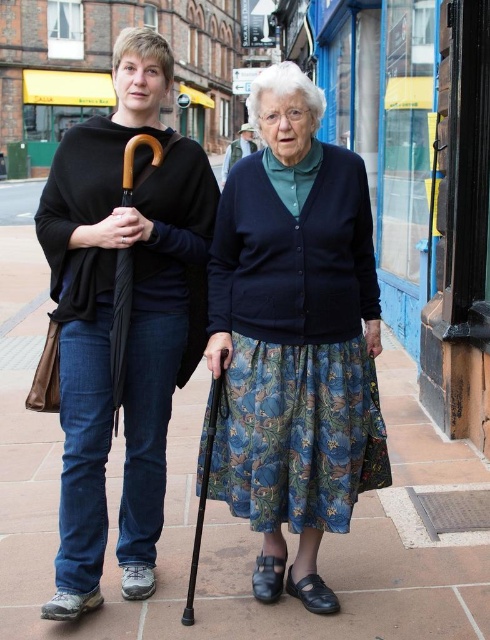
Question: Can you confirm if matte black umbrella at left is bigger than blue floral skirt at center?

Choices:
 (A) yes
 (B) no

Answer: (A)

Question: Which object is the farthest from the wooden cane at lower center?

Choices:
 (A) black matte umbrella at left
 (B) matte black umbrella at left
 (C) blue floral skirt at center

Answer: (A)

Question: Considering the real-world distances, which object is farthest from the matte black umbrella at left?

Choices:
 (A) wooden cane at lower center
 (B) blue floral skirt at center
 (C) black matte umbrella at left

Answer: (A)

Question: Considering the relative positions of matte black umbrella at left and wooden cane at lower center in the image provided, where is matte black umbrella at left located with respect to wooden cane at lower center?

Choices:
 (A) above
 (B) below

Answer: (A)

Question: Which point is closer to the camera?

Choices:
 (A) wooden cane at lower center
 (B) black matte umbrella at left
 (C) matte black umbrella at left
 (D) blue floral skirt at center

Answer: (C)

Question: Can you confirm if matte black umbrella at left is positioned below blue floral skirt at center?

Choices:
 (A) no
 (B) yes

Answer: (A)